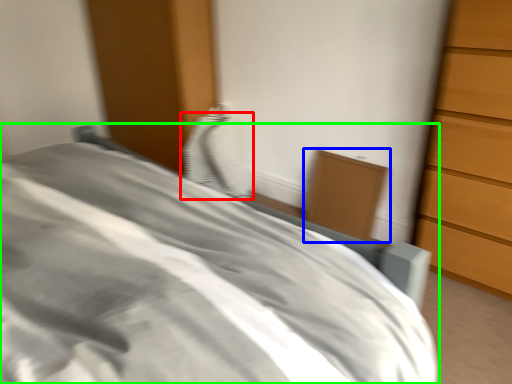
Question: Which is nearer to the pillow (highlighted by a red box)? cabinetry (highlighted by a blue box) or bed (highlighted by a green box).

Choices:
 (A) cabinetry
 (B) bed

Answer: (A)